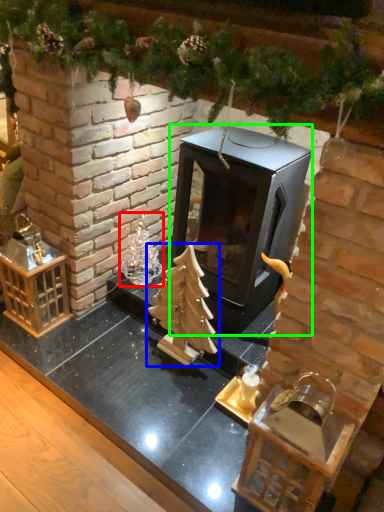
Question: Considering the real-world distances, which object is closest to christmas decoration (highlighted by a red box)? christmas tree (highlighted by a blue box) or fireplace (highlighted by a green box).

Choices:
 (A) christmas tree
 (B) fireplace

Answer: (A)